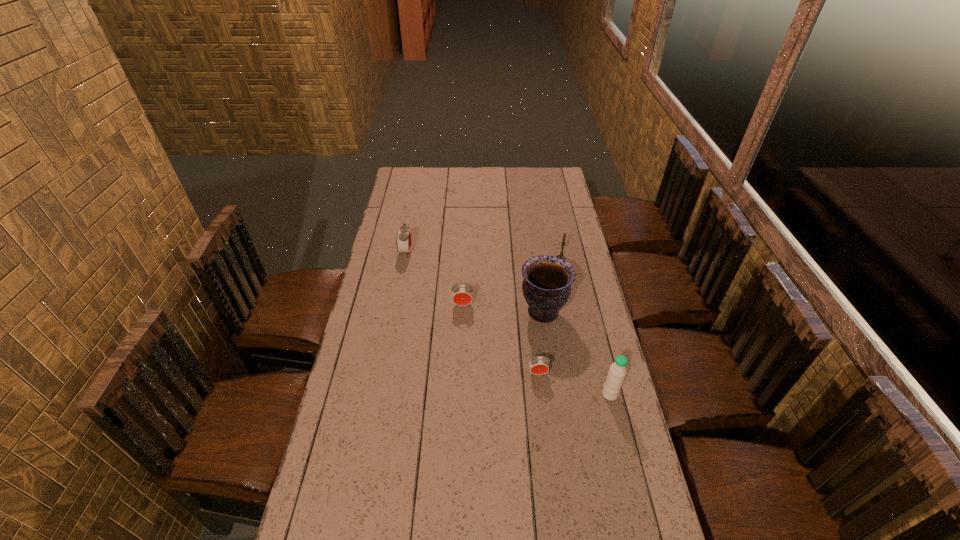
What are the coordinates of `free space that satisfies the following two spatial constraints: 1. on the front side of the candle; 2. on the front handle of the pottery` in the screenshot? It's located at (572, 313).

Locate an element on the screen. The width and height of the screenshot is (960, 540). blank space that satisfies the following two spatial constraints: 1. on the back side of the rightmost object; 2. on the front handle of the pottery is located at coordinates (590, 313).

Where is `free space in the image that satisfies the following two spatial constraints: 1. on the front handle of the pottery; 2. on the face of the rightmost alarm clock`? The width and height of the screenshot is (960, 540). free space in the image that satisfies the following two spatial constraints: 1. on the front handle of the pottery; 2. on the face of the rightmost alarm clock is located at coordinates (552, 373).

Locate an element on the screen. This screenshot has height=540, width=960. vacant space that satisfies the following two spatial constraints: 1. on the front handle of the pottery; 2. on the face of the rightmost alarm clock is located at coordinates (552, 373).